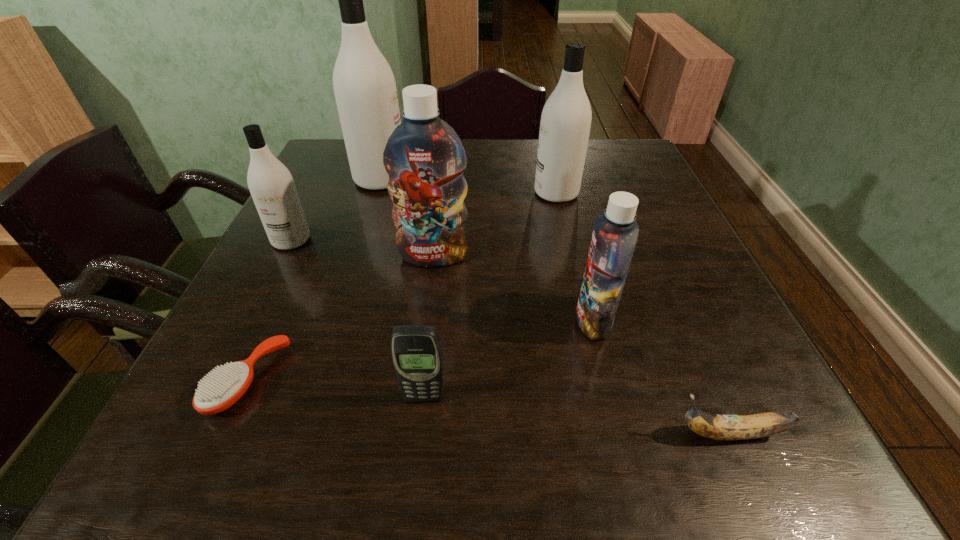
I want to click on free point between the tallest shampoo and the smallest white shampoo, so click(336, 210).

Identify which object is the fourth nearest to the orange hairbrush. Please provide its 2D coordinates. Your answer should be formatted as a tuple, i.e. [(x, y)], where the tuple contains the x and y coordinates of a point satisfying the conditions above.

[(365, 89)]

You are a GUI agent. You are given a task and a screenshot of the screen. Output one action in this format:
    pyautogui.click(x=<x>, y=<y>)
    Task: Click on the object that is the fifth nearest to the sixth tallest object
    The width and height of the screenshot is (960, 540).
    Given the screenshot: What is the action you would take?
    coord(270,183)

This screenshot has height=540, width=960. Find the location of `shampoo that stands as the closest to the second smallest white shampoo`. shampoo that stands as the closest to the second smallest white shampoo is located at coordinates (425, 159).

This screenshot has width=960, height=540. Find the location of `shampoo identified as the fifth closest to the shortest object`. shampoo identified as the fifth closest to the shortest object is located at coordinates (565, 123).

Point out which white shampoo is positioned as the third nearest to the fourth nearest object. Please provide its 2D coordinates. Your answer should be formatted as a tuple, i.e. [(x, y)], where the tuple contains the x and y coordinates of a point satisfying the conditions above.

[(270, 183)]

This screenshot has height=540, width=960. What are the coordinates of `white shampoo that is the second closest to the nearest object` in the screenshot? It's located at (270, 183).

This screenshot has height=540, width=960. What are the coordinates of `vacant area in the image that satisfies the following two spatial constraints: 1. on the front-facing side of the second smallest white shampoo; 2. on the front label of the third shampoo from right to left` in the screenshot? It's located at (571, 256).

I want to click on free region that satisfies the following two spatial constraints: 1. on the front-facing side of the biggest white shampoo; 2. on the front-facing side of the leftmost white shampoo, so pyautogui.click(x=362, y=240).

The width and height of the screenshot is (960, 540). Identify the location of blank area in the image that satisfies the following two spatial constraints: 1. on the front-facing side of the second biggest white shampoo; 2. on the front label of the third shampoo from left to right. (571, 256).